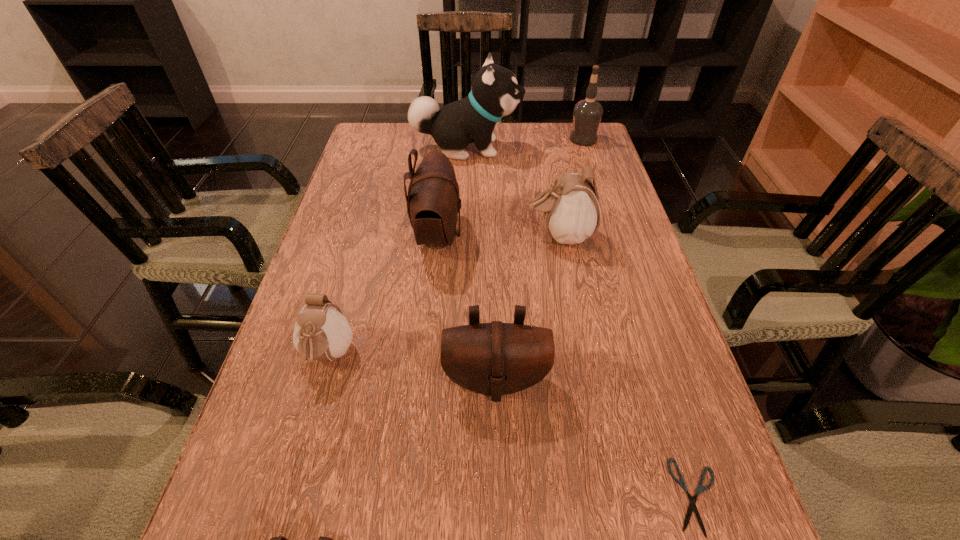
Find the location of a particular element. This screenshot has height=540, width=960. the seventh closest object relative to the nearer white pouch is located at coordinates (587, 114).

The width and height of the screenshot is (960, 540). In order to click on the third closest object to the nearer white pouch in this screenshot , I will do `click(281, 539)`.

Select which pouch is the second closest to the second smallest brown pouch. Please provide its 2D coordinates. Your answer should be formatted as a tuple, i.e. [(x, y)], where the tuple contains the x and y coordinates of a point satisfying the conditions above.

[(433, 204)]

The height and width of the screenshot is (540, 960). I want to click on pouch that can be found as the second closest to the bigger white pouch, so click(x=496, y=358).

You are a GUI agent. You are given a task and a screenshot of the screen. Output one action in this format:
    pyautogui.click(x=<x>, y=<y>)
    Task: Click on the brown pouch that can be found as the second closest to the vodka
    The image size is (960, 540).
    Given the screenshot: What is the action you would take?
    pyautogui.click(x=496, y=358)

The width and height of the screenshot is (960, 540). In order to click on the second closest brown pouch to the second smallest brown pouch in this screenshot , I will do `click(281, 539)`.

At what (x,y) coordinates should I click in order to perform the action: click on free region that satisfies the following two spatial constraints: 1. at the face of the white puppy; 2. on the front-facing side of the nearer white pouch. Please return your answer as a coordinate pair (x, y). This screenshot has width=960, height=540. Looking at the image, I should click on (458, 356).